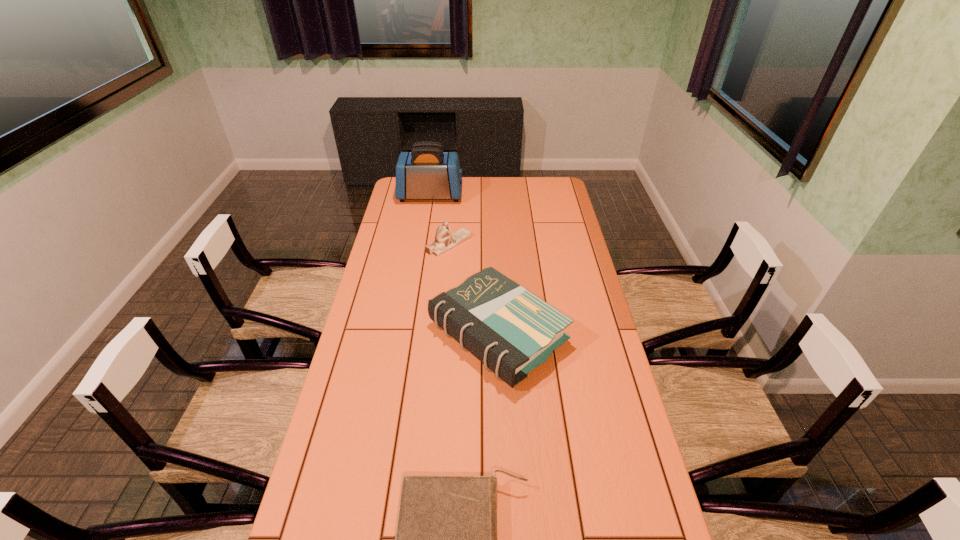
I want to click on the farthest object, so click(426, 172).

The width and height of the screenshot is (960, 540). I want to click on toaster, so click(x=426, y=172).

This screenshot has height=540, width=960. Identify the location of the taller paperback book. (510, 330).

The height and width of the screenshot is (540, 960). I want to click on the second nearest object, so click(510, 330).

The height and width of the screenshot is (540, 960). I want to click on the second farthest object, so click(444, 239).

Find the location of a particular element. free region located 0.380m on the front-facing side of the farthest object is located at coordinates (537, 195).

Find the location of a particular element. vacant area situated on the back of the taller paperback book is located at coordinates (495, 259).

You are a GUI agent. You are given a task and a screenshot of the screen. Output one action in this format:
    pyautogui.click(x=<x>, y=<y>)
    Task: Click on the blank space located 0.200m on the front-facing side of the figurine
    The image size is (960, 540).
    Given the screenshot: What is the action you would take?
    click(517, 244)

The height and width of the screenshot is (540, 960). I want to click on object that is at the far edge, so click(x=426, y=172).

Identify the location of object present at the left edge. (426, 172).